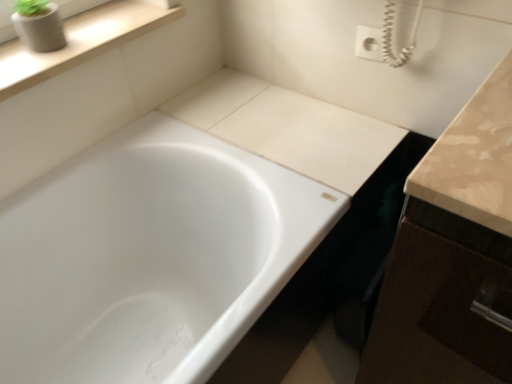
You are a GUI agent. You are given a task and a screenshot of the screen. Output one action in this format:
    pyautogui.click(x=<x>, y=<y>)
    Task: Click on the unoccupied space behind matte gray concrete planter at upper left
    This screenshot has width=512, height=384.
    Given the screenshot: What is the action you would take?
    pyautogui.click(x=91, y=20)